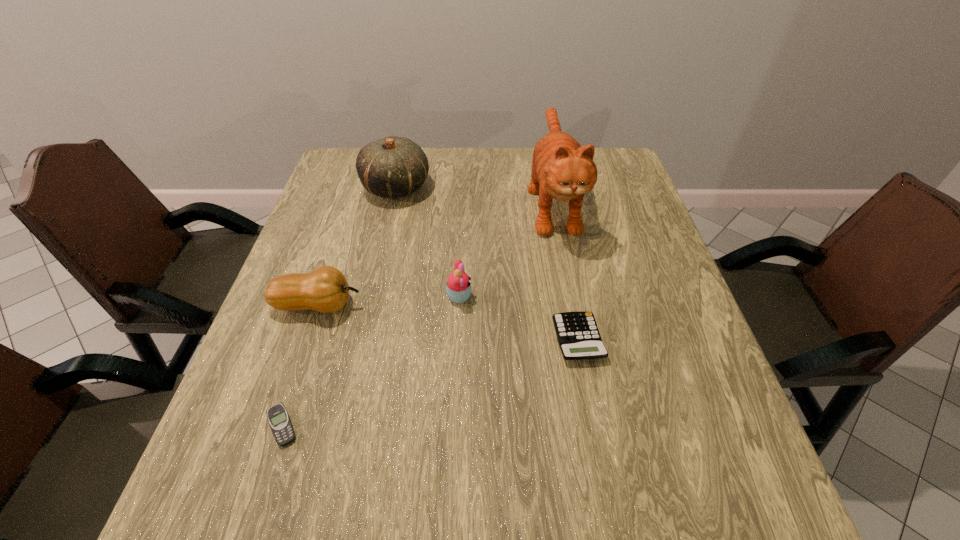
Identify the location of empty space between the beeper and the third object from right to left. The height and width of the screenshot is (540, 960). click(x=371, y=361).

Image resolution: width=960 pixels, height=540 pixels. What are the coordinates of `vacant area that lies between the cat and the beeper` in the screenshot? It's located at (418, 313).

Image resolution: width=960 pixels, height=540 pixels. What are the coordinates of `vacant point located between the cat and the shortest object` in the screenshot? It's located at (418, 313).

Select which object is the closest to the nearer gourd. Please provide its 2D coordinates. Your answer should be formatted as a tuple, i.e. [(x, y)], where the tuple contains the x and y coordinates of a point satisfying the conditions above.

[(458, 289)]

Where is `object identified as the fifth closest to the nearest object`? The height and width of the screenshot is (540, 960). object identified as the fifth closest to the nearest object is located at coordinates (561, 169).

This screenshot has height=540, width=960. In order to click on vacant area that satisfies the following two spatial constraints: 1. on the stem side of the nearer gourd; 2. on the back side of the shortest object in this screenshot , I will do `click(277, 426)`.

The image size is (960, 540). In order to click on free region that satisfies the following two spatial constraints: 1. on the face of the second shortest object; 2. on the right side of the third object from right to left in this screenshot , I will do `click(457, 339)`.

The image size is (960, 540). What are the coordinates of `vacant space that satisfies the following two spatial constraints: 1. on the face of the cat; 2. on the face of the fourth object from left to right` in the screenshot? It's located at (571, 297).

You are a GUI agent. You are given a task and a screenshot of the screen. Output one action in this format:
    pyautogui.click(x=<x>, y=<y>)
    Task: Click on the vacant space that satisfies the following two spatial constraints: 1. on the back side of the calculator; 2. on the stem side of the nearer gourd
    Image resolution: width=960 pixels, height=540 pixels.
    Given the screenshot: What is the action you would take?
    571,305

Locate an element on the screen. This screenshot has height=540, width=960. vacant space that satisfies the following two spatial constraints: 1. on the stem side of the nearest object; 2. on the right side of the shorter gourd is located at coordinates (277, 426).